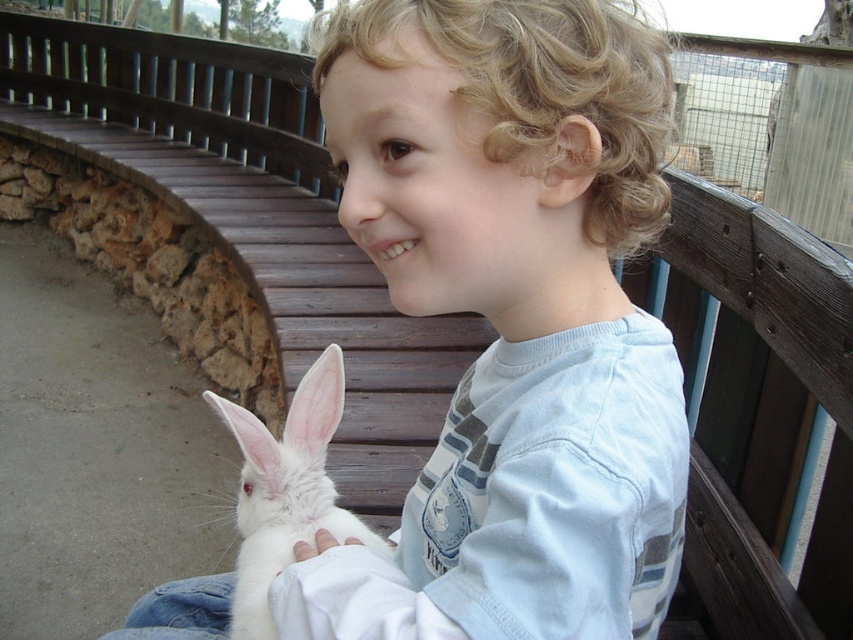
Question: Which of the following is the closest to the observer?

Choices:
 (A) (321, 500)
 (B) (630, 16)

Answer: (B)

Question: Does white soft fur rabbit at center lie in front of white fluffy rabbit at lower left?

Choices:
 (A) no
 (B) yes

Answer: (B)

Question: Observing the image, what is the correct spatial positioning of white soft fur rabbit at center in reference to white fluffy rabbit at lower left?

Choices:
 (A) left
 (B) right

Answer: (B)

Question: Does white soft fur rabbit at center have a larger size compared to white fluffy rabbit at lower left?

Choices:
 (A) yes
 (B) no

Answer: (A)

Question: Among these objects, which one is farthest from the camera?

Choices:
 (A) white soft fur rabbit at center
 (B) white fluffy rabbit at lower left

Answer: (B)